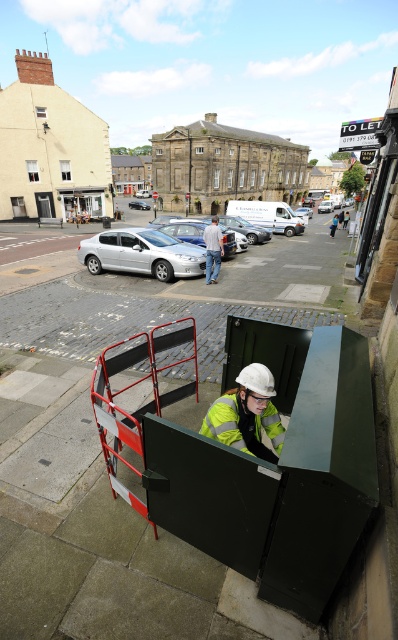
Does green matte construction platform at center have a smaller size compared to silver metallic car at center-left?

Incorrect, green matte construction platform at center is not smaller in size than silver metallic car at center-left.

Is green matte construction platform at center further to the viewer compared to silver metallic car at center-left?

No, green matte construction platform at center is in front of silver metallic car at center-left.

Who is more distant from viewer, (44,360) or (191,262)?

The point (191,262) is behind.

Where is `green matte construction platform at center`? green matte construction platform at center is located at coordinates (173, 420).

Who is more distant from viewer, (179, 241) or (132, 204)?

The point (132, 204) is behind.

Between silver metallic car at center-left and silver metallic car at center, which one appears on the right side from the viewer's perspective?

Positioned to the right is silver metallic car at center-left.

Measure the distance between point (87, 237) and camera.

Point (87, 237) is 21.61 meters from camera.

Where is `silver metallic car at center-left`? The width and height of the screenshot is (398, 640). silver metallic car at center-left is located at coordinates (142, 253).

Is silver metallic car at center-left to the right of denim jeans at center from the viewer's perspective?

No, silver metallic car at center-left is not to the right of denim jeans at center.

Is point (99, 260) positioned in front of point (206, 280)?

No, (99, 260) is behind (206, 280).

Is point (159, 272) more distant than point (210, 273)?

That is True.

Find the location of a particular element. This screenshot has width=398, height=640. silver metallic car at center-left is located at coordinates click(142, 253).